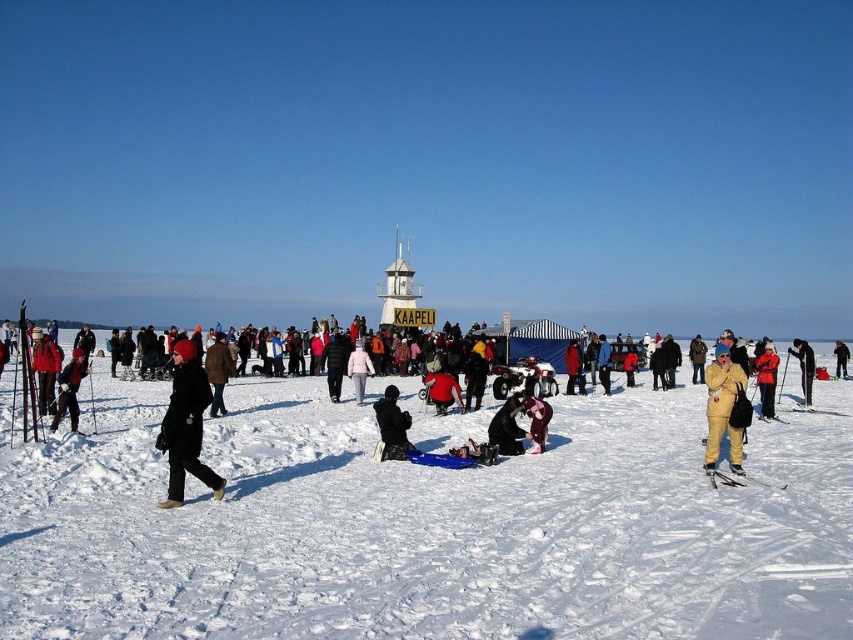
You are an observer standing on the snow in the winter scene. You notice a matte black ski at left and a yellow matte snowsuit at lower right. Which object is wider?

The matte black ski at left is wider than the yellow matte snowsuit at lower right.

You are organizing a winter sports event and need to display two pairs of skis for a demonstration. The matte black ski at left and the metallic skis at lower right are available. Which pair should you choose if you want the wider skis for better stability in deep snow?

The matte black ski at left has a larger width than the metallic skis at lower right, so you should choose the matte black ski at left for better stability in deep snow.

You are standing at the lighthouse and want to move towards the two points marked in the image. Which point, point (x=41, y=481) or point (x=26, y=328), is closer to you?

Point (x=41, y=481) is closer to the viewer than point (x=26, y=328).